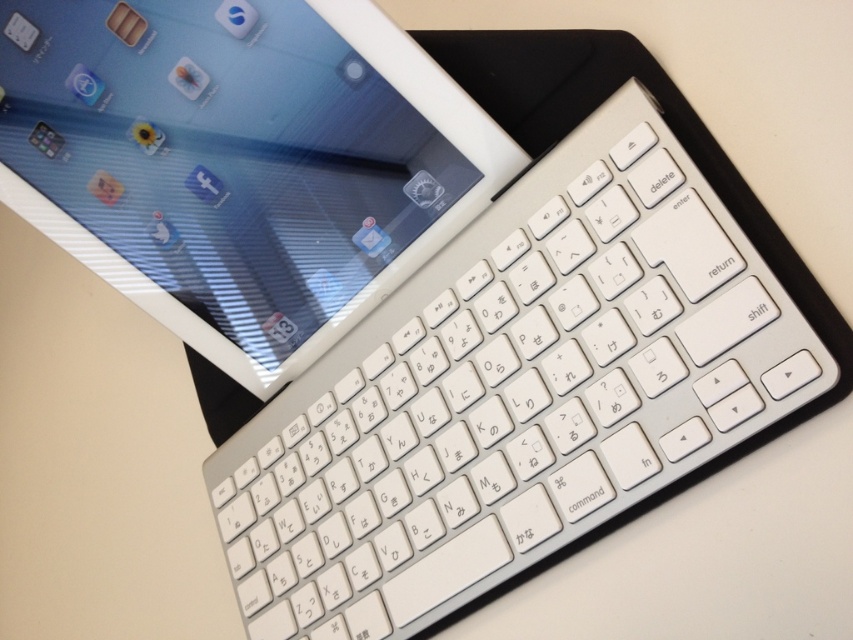
You are setting up a workspace and need to place the white plastic keyboard at upper center and the white glossy tablet at upper left. Based on the scene, where should you position the tablet relative to the keyboard?

The white plastic keyboard at upper center is positioned under the white glossy tablet at upper left, so you should place the tablet above the keyboard.

You are setting up a workspace and need to place the white plastic keyboard at upper center and the white glossy tablet at upper left. According to the image, which object should be positioned to the left side of your workspace?

The white glossy tablet at upper left should be positioned to the left side of your workspace because the white plastic keyboard at upper center is to the right of it.